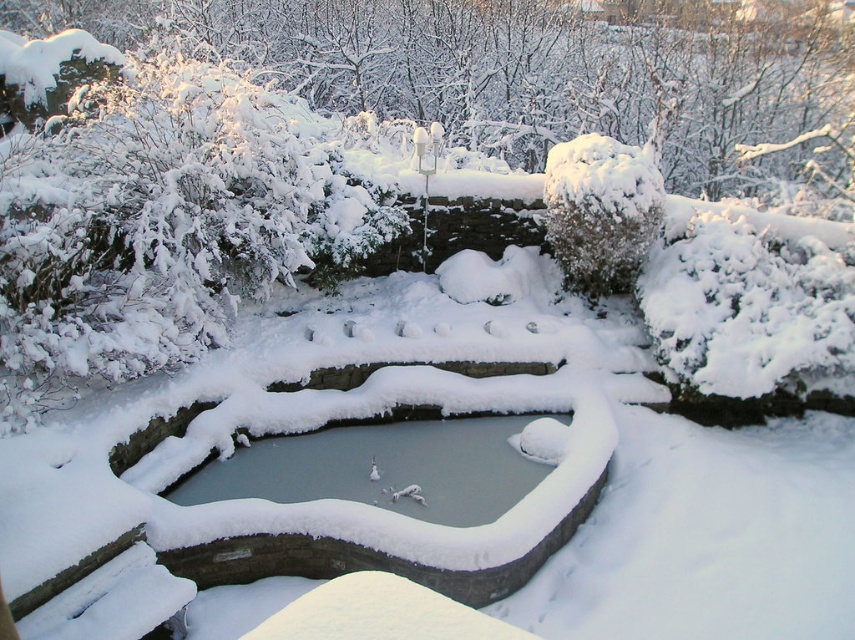
Does white snow-covered tree at upper center appear under clear ice pond at center?

Incorrect, white snow-covered tree at upper center is not positioned below clear ice pond at center.

Which is behind, point (677, 68) or point (464, 483)?

The point (677, 68) is behind.

Where is `white snow-covered tree at upper center`? white snow-covered tree at upper center is located at coordinates (538, 72).

Does white fluffy bush at upper left have a lesser width compared to white snow-covered tree at upper center?

Yes.

Between white fluffy bush at upper left and white snow-covered tree at upper center, which one has more height?

Standing taller between the two is white snow-covered tree at upper center.

Measure the distance between white fluffy bush at upper left and camera.

A distance of 4.74 meters exists between white fluffy bush at upper left and camera.

Locate an element on the screen. white fluffy bush at upper left is located at coordinates (171, 224).

Based on the photo, does white fluffy bush at upper left have a larger size compared to clear ice pond at center?

Yes.

Is white fluffy bush at upper left above clear ice pond at center?

Indeed, white fluffy bush at upper left is positioned over clear ice pond at center.

Does point (63, 310) come behind point (328, 490)?

That is False.

The height and width of the screenshot is (640, 855). Identify the location of white fluffy bush at upper left. [x=171, y=224].